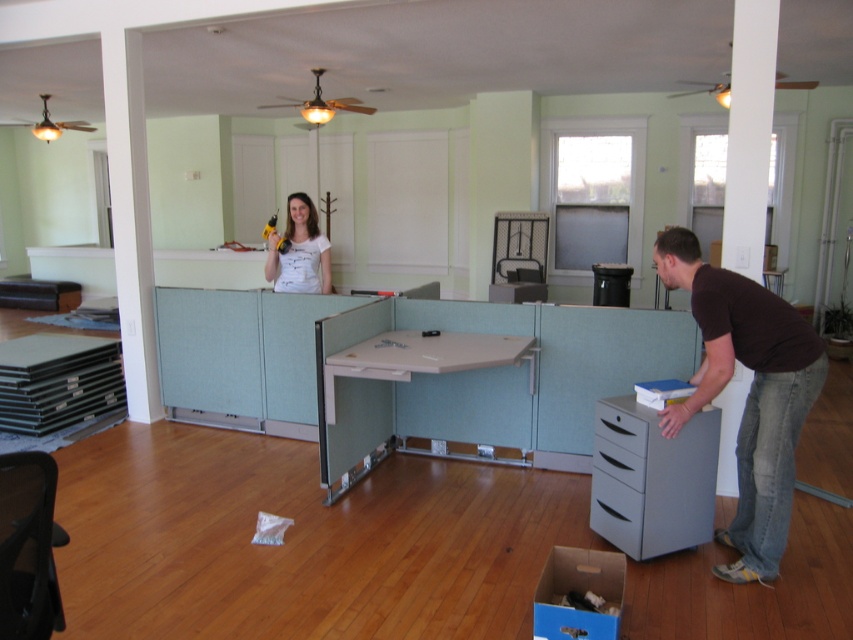
Question: Is matte gray drawer at lower right wider than matte white shirt at upper center?

Choices:
 (A) no
 (B) yes

Answer: (A)

Question: Which object appears closest to the camera in this image?

Choices:
 (A) gray matte file cabinet at lower right
 (B) matte gray drawer at lower right

Answer: (A)

Question: Considering the real-world distances, which object is closest to the blue cardboard box at lower center?

Choices:
 (A) metallic gray drawer at lower right
 (B) matte white shirt at upper center
 (C) gray matte file cabinet at lower right

Answer: (C)

Question: Where is brown cotton shirt at right located in relation to matte white shirt at upper center in the image?

Choices:
 (A) right
 (B) left

Answer: (A)

Question: Which point is farther from the camera taking this photo?

Choices:
 (A) (590, 586)
 (B) (686, 420)
 (C) (612, 468)
 (D) (605, 410)

Answer: (D)

Question: Can you confirm if matte gray drawer at center is positioned above metallic gray drawer at lower right?

Choices:
 (A) no
 (B) yes

Answer: (B)